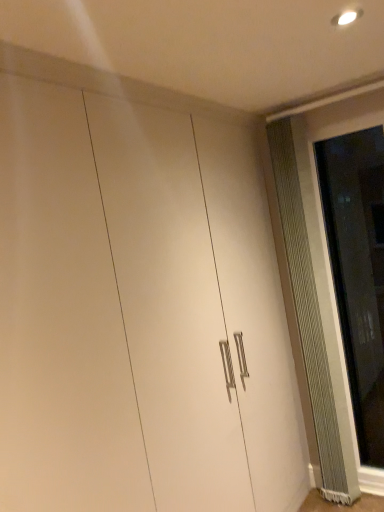
Question: Relative to metallic ribbed radiator at right, is clear glass screen door at right in front or behind?

Choices:
 (A) behind
 (B) front

Answer: (B)

Question: Considering the positions of clear glass screen door at right and metallic ribbed radiator at right in the image, is clear glass screen door at right bigger or smaller than metallic ribbed radiator at right?

Choices:
 (A) big
 (B) small

Answer: (B)

Question: Is clear glass screen door at right wider or thinner than metallic ribbed radiator at right?

Choices:
 (A) wide
 (B) thin

Answer: (B)

Question: From the image's perspective, is metallic ribbed radiator at right above or below clear glass screen door at right?

Choices:
 (A) below
 (B) above

Answer: (A)

Question: In the image, is metallic ribbed radiator at right on the left side or the right side of clear glass screen door at right?

Choices:
 (A) right
 (B) left

Answer: (B)

Question: From a real-world perspective, is metallic ribbed radiator at right positioned above or below clear glass screen door at right?

Choices:
 (A) above
 (B) below

Answer: (A)

Question: Is metallic ribbed radiator at right inside the boundaries of clear glass screen door at right, or outside?

Choices:
 (A) outside
 (B) inside

Answer: (A)